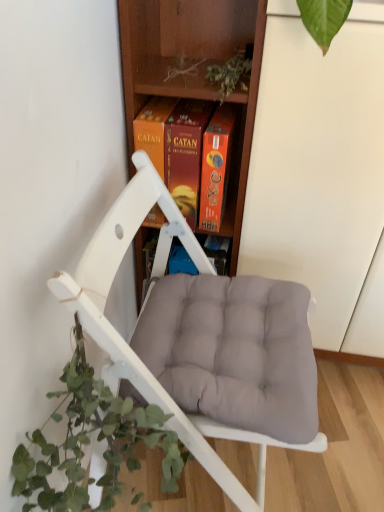
Question: Looking at their shapes, would you say wooden at center is wider or thinner than green leafy plant at lower left?

Choices:
 (A) wide
 (B) thin

Answer: (A)

Question: From a real-world perspective, relative to green leafy plant at lower left, is wooden at center vertically above or below?

Choices:
 (A) below
 (B) above

Answer: (B)

Question: Which of these objects is positioned closest to the white matte chair at center?

Choices:
 (A) green leafy plant at lower left
 (B) wooden at center
 (C) orange cardboard game box at center

Answer: (A)

Question: Which object is the closest to the orange cardboard game box at center?

Choices:
 (A) green leafy plant at lower left
 (B) wooden at center
 (C) white matte chair at center

Answer: (B)